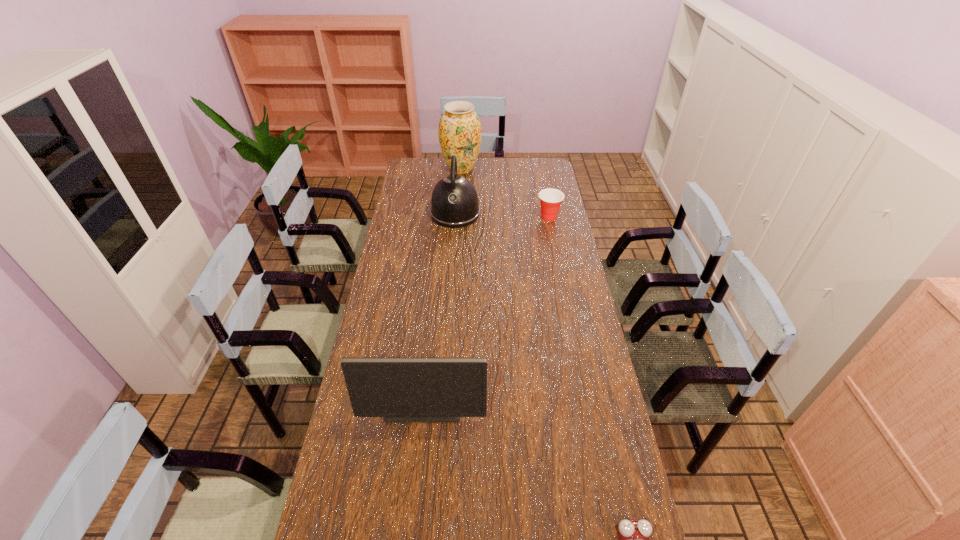
This screenshot has width=960, height=540. What are the coordinates of `object at the left edge` in the screenshot? It's located at (399, 389).

Where is `object that is positioned at the right edge`? The image size is (960, 540). object that is positioned at the right edge is located at coordinates (550, 199).

At what (x,y) coordinates should I click in order to perform the action: click on vacant region at the far edge of the desktop. Please return your answer as a coordinate pair (x, y). Looking at the image, I should click on (483, 169).

Where is `vacant area at the left edge of the desktop`? vacant area at the left edge of the desktop is located at coordinates (372, 327).

At what (x,y) coordinates should I click in order to perform the action: click on free space at the right edge of the desktop. Please return your answer as a coordinate pair (x, y). This screenshot has width=960, height=540. Looking at the image, I should click on (581, 391).

Image resolution: width=960 pixels, height=540 pixels. I want to click on vacant region at the far left corner of the desktop, so click(x=433, y=165).

Where is `vacant area that lies between the cup and the kettle`? Image resolution: width=960 pixels, height=540 pixels. vacant area that lies between the cup and the kettle is located at coordinates (502, 215).

Identify the location of unoccupied area between the cup and the second nearest object. (487, 310).

This screenshot has width=960, height=540. Find the location of `vacant region between the cup and the farthest object`. vacant region between the cup and the farthest object is located at coordinates (505, 193).

Where is `vacant space that is in between the farthest object and the computer monitor`? This screenshot has height=540, width=960. vacant space that is in between the farthest object and the computer monitor is located at coordinates (443, 286).